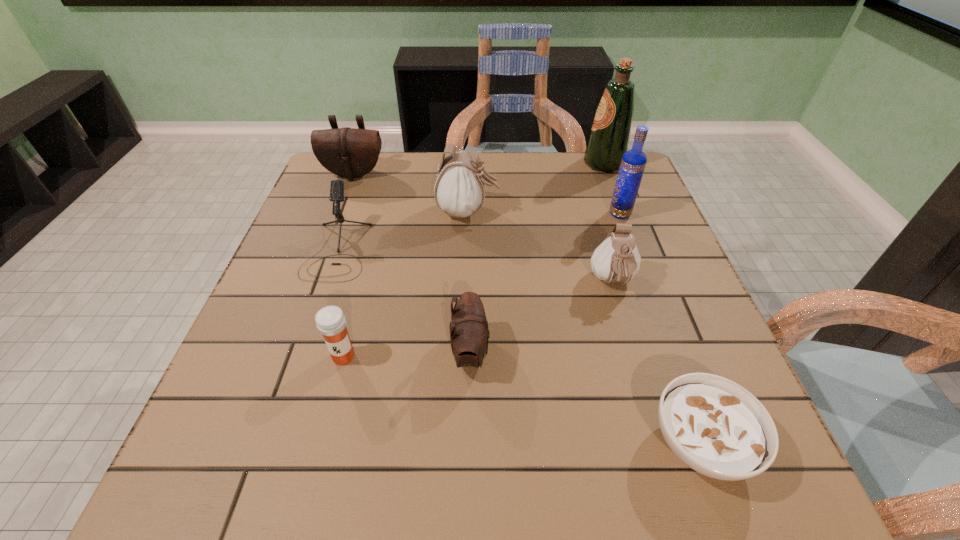
Find the location of a particular element. Image resolution: width=960 pixels, height=540 pixels. olive oil is located at coordinates (609, 138).

The image size is (960, 540). In order to click on green olive oil in this screenshot , I will do `click(609, 138)`.

Locate an element on the screen. The height and width of the screenshot is (540, 960). the second tallest object is located at coordinates (633, 163).

This screenshot has width=960, height=540. In order to click on blue vodka in this screenshot , I will do [x=633, y=163].

Where is `the bigger white pouch`? the bigger white pouch is located at coordinates (459, 191).

Find the location of a particular element. The width and height of the screenshot is (960, 540). the left white pouch is located at coordinates (459, 191).

I want to click on the farther brown pouch, so click(347, 152).

Find the location of a particular element. The height and width of the screenshot is (540, 960). the farthest pouch is located at coordinates (347, 152).

In order to click on the smaller white pouch in this screenshot , I will do `click(616, 260)`.

Where is `the second nearest pouch`? the second nearest pouch is located at coordinates [616, 260].